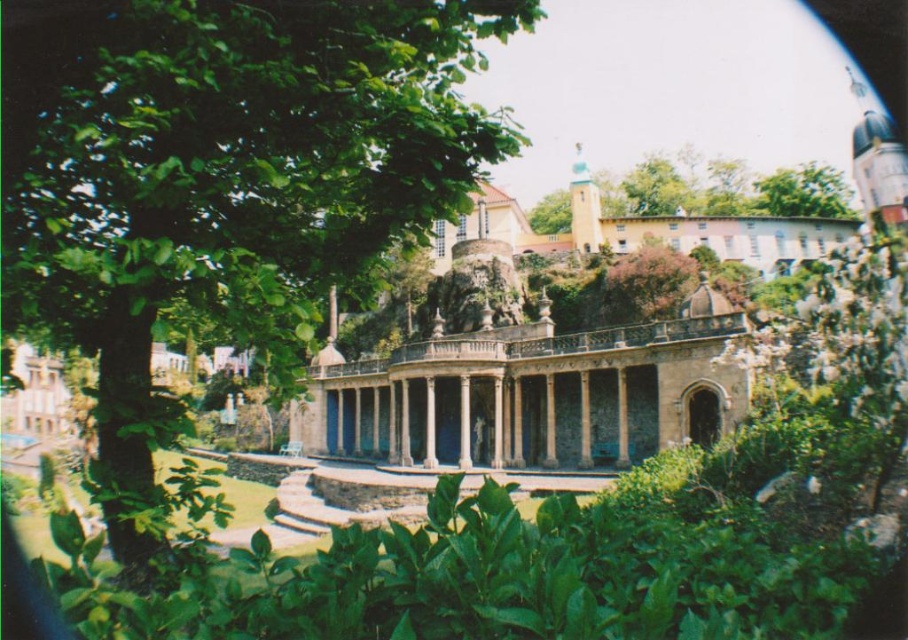
Question: Is the position of green leafy tree at center more distant than that of green leafy tree at upper right?

Choices:
 (A) yes
 (B) no

Answer: (B)

Question: Which of the following is the closest to the observer?

Choices:
 (A) green leafy tree at center
 (B) green leafy tree at upper right

Answer: (A)

Question: Which object is farther from the camera taking this photo?

Choices:
 (A) green leafy tree at center
 (B) green leafy tree at upper right

Answer: (B)

Question: Is green leafy tree at center closer to the viewer compared to green leafy tree at upper right?

Choices:
 (A) yes
 (B) no

Answer: (A)

Question: Which of the following is the farthest from the observer?

Choices:
 (A) green leafy tree at center
 (B) green leafy tree at upper right

Answer: (B)

Question: Does green leafy tree at center have a smaller size compared to green leafy tree at upper right?

Choices:
 (A) no
 (B) yes

Answer: (A)